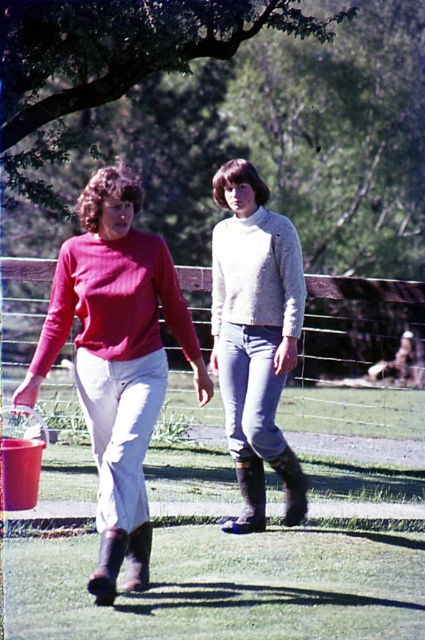
Question: Is matte red sweater at left positioned behind matte red sweater at center?

Choices:
 (A) yes
 (B) no

Answer: (B)

Question: Which object appears closest to the camera in this image?

Choices:
 (A) matte red sweater at center
 (B) matte red sweater at left
 (C) light gray knitted sweater at center

Answer: (B)

Question: Does light gray sweater at center appear on the right side of matte red sweater at center?

Choices:
 (A) no
 (B) yes

Answer: (B)

Question: Considering the real-world distances, which object is closest to the matte red sweater at left?

Choices:
 (A) light gray sweater at center
 (B) light gray knitted sweater at center
 (C) matte red sweater at center

Answer: (C)

Question: Which of the following is the closest to the observer?

Choices:
 (A) matte red sweater at center
 (B) matte red sweater at left
 (C) light gray knitted sweater at center

Answer: (B)

Question: Does matte red sweater at left appear over matte red sweater at center?

Choices:
 (A) no
 (B) yes

Answer: (A)